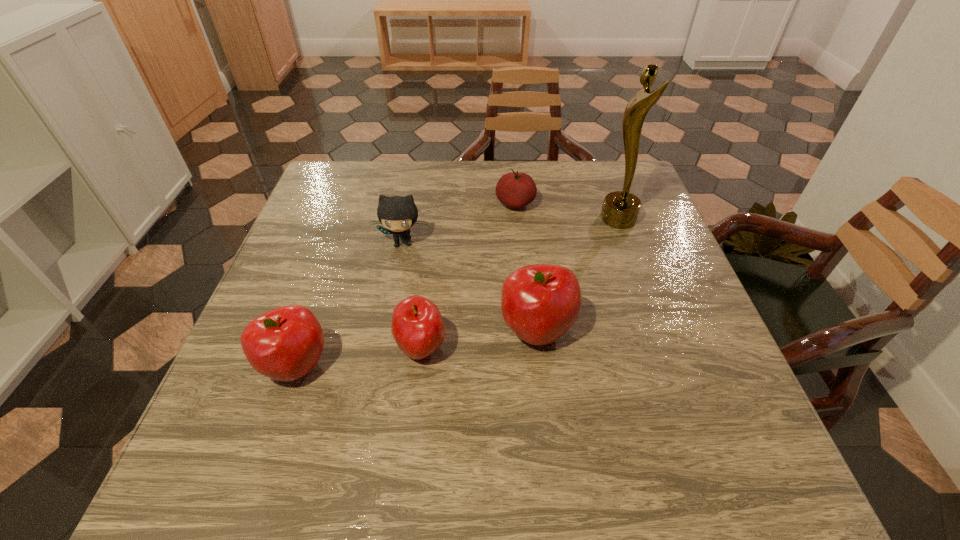
At what (x,y) coordinates should I click in order to perform the action: click on free area in between the rightmost apple and the second apple from right to left. Please return your answer as a coordinate pair (x, y). This screenshot has height=540, width=960. Looking at the image, I should click on (479, 339).

Where is `free spot between the leftmost apple and the award`? The image size is (960, 540). free spot between the leftmost apple and the award is located at coordinates (458, 293).

The height and width of the screenshot is (540, 960). What are the coordinates of `blank region between the tallest object and the rightmost apple` in the screenshot? It's located at (578, 275).

This screenshot has height=540, width=960. I want to click on free space between the kitten and the shortest apple, so click(x=412, y=295).

Identify the location of vacant space in between the second tallest apple and the rightmost object. The image size is (960, 540). (458, 293).

Find the location of `empty space that is in between the second apple from left to right and the leftmost apple`. empty space that is in between the second apple from left to right and the leftmost apple is located at coordinates (359, 357).

This screenshot has width=960, height=540. Identify the location of free space between the tomato and the shortest apple. (468, 276).

Find the location of a particular element. The image size is (960, 540). object that stands as the second closest to the shortest object is located at coordinates click(397, 214).

Identify the location of object that is the fourth closest one to the leftmost apple. click(515, 189).

Point out which apple is positioned as the second nearest to the kitten. Please provide its 2D coordinates. Your answer should be formatted as a tuple, i.e. [(x, y)], where the tuple contains the x and y coordinates of a point satisfying the conditions above.

[(539, 303)]